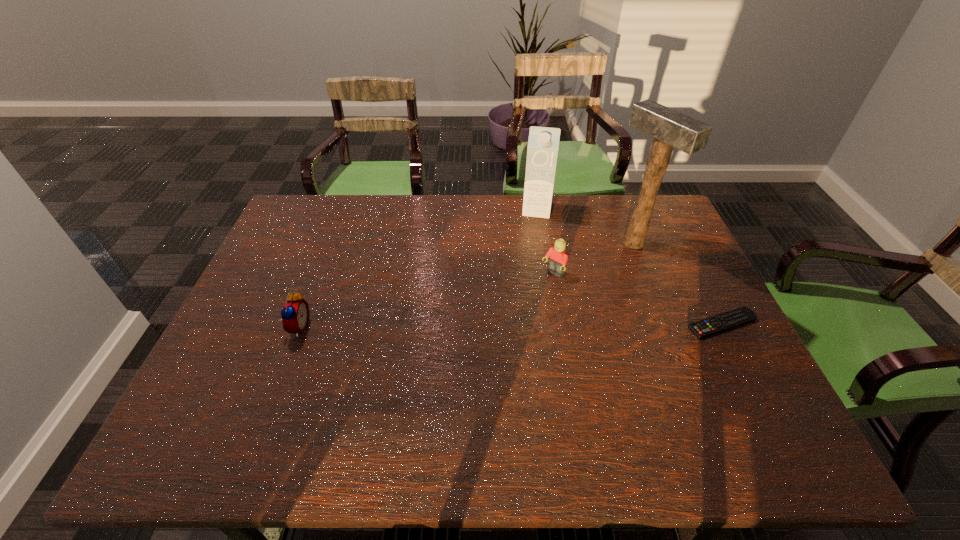
I want to click on vacant area that lies between the mallet and the shortest object, so pyautogui.click(x=678, y=284).

Where is `vacant point located between the leftmost object and the third nearest object`? Image resolution: width=960 pixels, height=540 pixels. vacant point located between the leftmost object and the third nearest object is located at coordinates (426, 301).

What are the coordinates of `vacant space in between the fourth shortest object and the remote control` in the screenshot? It's located at (630, 267).

You are a GUI agent. You are given a task and a screenshot of the screen. Output one action in this format:
    pyautogui.click(x=<x>, y=<y>)
    Task: Click on the blank region between the farthest object and the shortest object
    The image size is (960, 540).
    Given the screenshot: What is the action you would take?
    pyautogui.click(x=630, y=267)

This screenshot has height=540, width=960. Identify the location of free space that is in between the alarm clock and the remote control. [510, 326].

Identify the location of free spot between the remote control and the alarm clock. (510, 326).

You are a GUI agent. You are given a task and a screenshot of the screen. Output one action in this format:
    pyautogui.click(x=<x>, y=<y>)
    Task: Click on the vacant space in between the alarm clock and the shortest object
    
    Given the screenshot: What is the action you would take?
    pyautogui.click(x=510, y=326)

Image resolution: width=960 pixels, height=540 pixels. Find the location of `free space between the leftmost object and the second farthest object`. free space between the leftmost object and the second farthest object is located at coordinates (466, 285).

The image size is (960, 540). I want to click on vacant space that is in between the remote control and the leftmost object, so click(x=510, y=326).

Identify which object is the second nearest to the third farthest object. Please provide its 2D coordinates. Your answer should be formatted as a tuple, i.e. [(x, y)], where the tuple contains the x and y coordinates of a point satisfying the conditions above.

[(543, 144)]